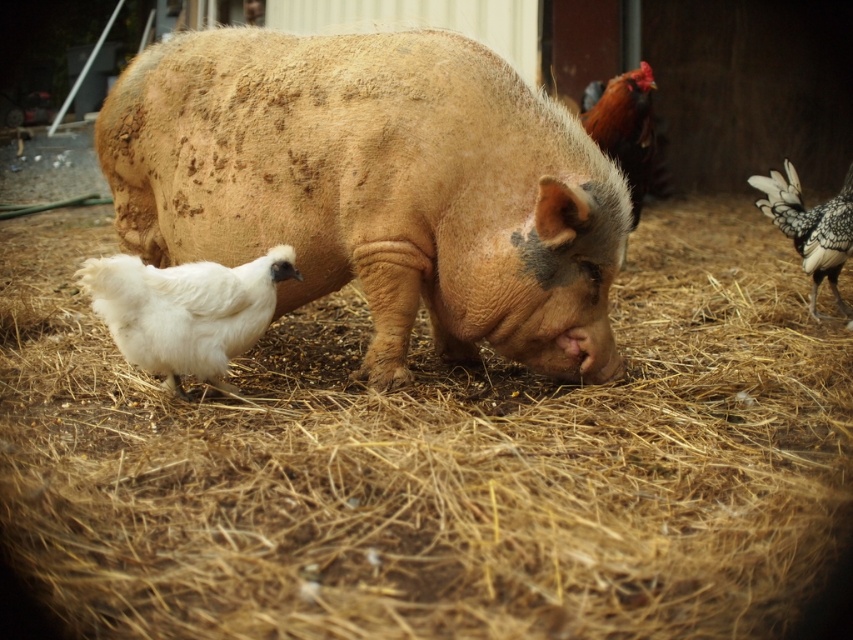
You are a farmer checking the farmyard. You see the brown textured pig at center and the white feathered chicken at right. Which animal is more to the left?

The brown textured pig at center is more to the left than the white feathered chicken at right.

You are standing in the farmyard and want to find the white fluffy chicken at lower left and the white feathered chicken at right. Which chicken is positioned lower in the scene?

The white fluffy chicken at lower left is positioned lower than the white feathered chicken at right.

You are standing in the farmyard and want to reach a specific point marked at coordinates point (376, 458). You are currently 10 feet away from this point. If you walk directly toward it, how many more feet do you need to walk to reach the point?

You are currently 10 feet away from the point (376, 458), and the distance of point (376, 458) from viewer is 7.75 feet. Therefore, you need to walk 10 feet minus 7.75 feet equals 2.25 feet more to reach the point.